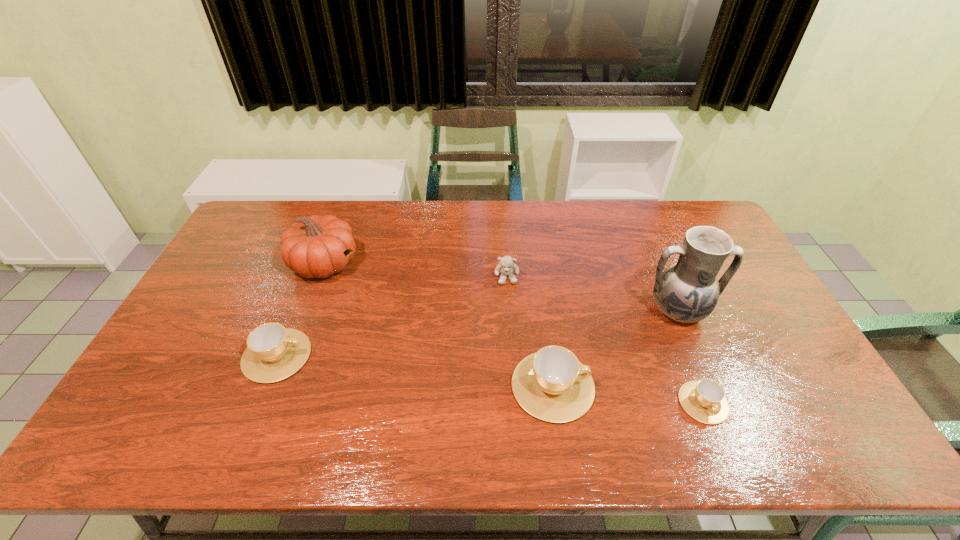
To make them evenly spaced by inserting another cup among them, please locate a vacant spot for this new cup. Please provide its 2D coordinates. Your answer should be formatted as a tuple, i.e. [(x, y)], where the tuple contains the x and y coordinates of a point satisfying the conditions above.

[(411, 370)]